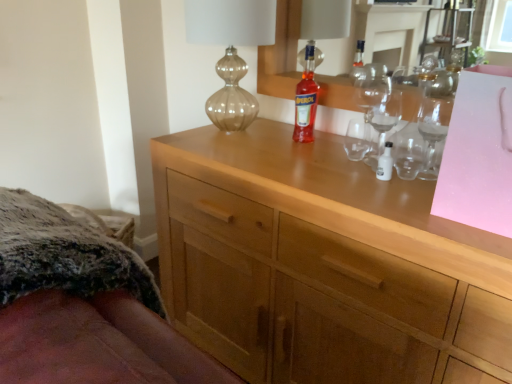
This screenshot has height=384, width=512. Find the location of `vacant space underneath translucent glass vase at upper center (from a real-world perspective)`. vacant space underneath translucent glass vase at upper center (from a real-world perspective) is located at coordinates (233, 134).